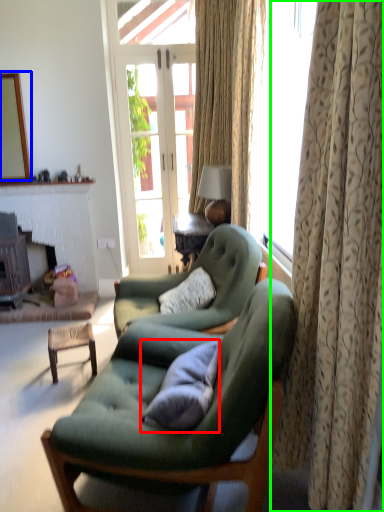
Question: Estimate the real-world distances between objects in this image. Which object is farther from pillow (highlighted by a red box), mirror (highlighted by a blue box) or curtain (highlighted by a green box)?

Choices:
 (A) mirror
 (B) curtain

Answer: (A)